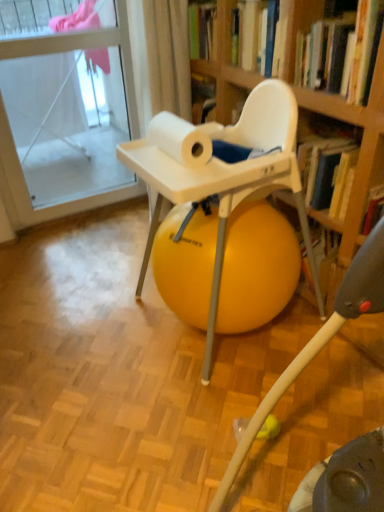
Where is `free space to the left of yellow rubber ball at center`? Image resolution: width=384 pixels, height=512 pixels. free space to the left of yellow rubber ball at center is located at coordinates point(97,329).